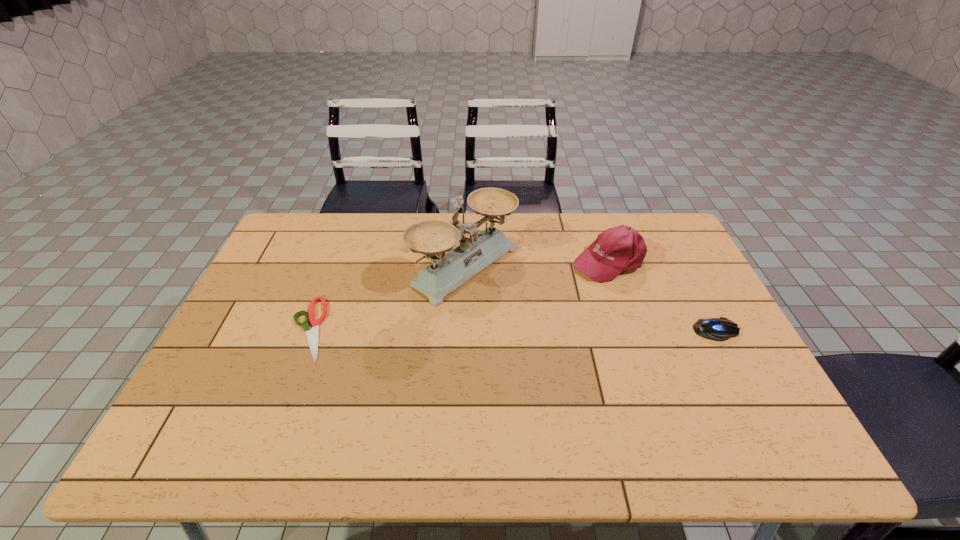
The width and height of the screenshot is (960, 540). I want to click on the leftmost object, so click(312, 335).

The height and width of the screenshot is (540, 960). I want to click on the shortest object, so click(312, 335).

The height and width of the screenshot is (540, 960). In order to click on the second shortest object in this screenshot , I will do `click(720, 329)`.

Identify the location of the rightmost object. (720, 329).

This screenshot has height=540, width=960. Find the location of `baseball cap`. baseball cap is located at coordinates (618, 249).

This screenshot has height=540, width=960. Find the location of `the second tallest object`. the second tallest object is located at coordinates (618, 249).

What are the coordinates of `the tallest object` in the screenshot? It's located at (432, 238).

The width and height of the screenshot is (960, 540). What are the coordinates of `the third object from right to left` in the screenshot? It's located at (432, 238).

Where is `free space located on the right of the scissors`? The width and height of the screenshot is (960, 540). free space located on the right of the scissors is located at coordinates (416, 329).

Locate an element on the screen. The width and height of the screenshot is (960, 540). free space located 0.130m at the front of the baseball cap with the brim is located at coordinates (547, 288).